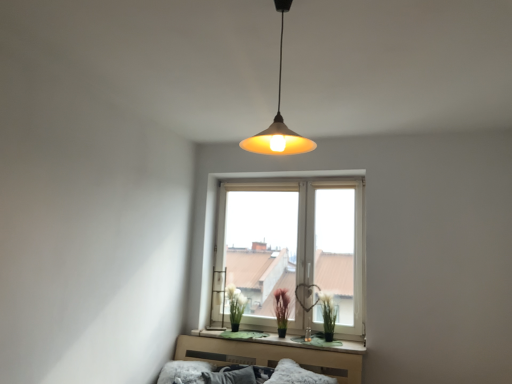
Question: Is fluffy white pillow at lower center, the 1th pillow from the left, to the left of purple matte plant at center, arranged as the first plant when viewed from the left, from the viewer's perspective?

Choices:
 (A) no
 (B) yes

Answer: (B)

Question: Can you confirm if fluffy white pillow at lower center, the second pillow when ordered from right to left, is positioned to the right of purple matte plant at center, arranged as the first plant when viewed from the left?

Choices:
 (A) yes
 (B) no

Answer: (B)

Question: From a real-world perspective, does fluffy white pillow at lower center, the 1th pillow from the left, stand above purple matte plant at center, placed as the second plant when sorted from right to left?

Choices:
 (A) no
 (B) yes

Answer: (A)

Question: Is purple matte plant at center, arranged as the first plant when viewed from the left, at the back of fluffy white pillow at lower center, the 1th pillow from the left?

Choices:
 (A) yes
 (B) no

Answer: (B)

Question: Is fluffy white pillow at lower center, the 1th pillow from the left, in front of purple matte plant at center, placed as the second plant when sorted from right to left?

Choices:
 (A) yes
 (B) no

Answer: (A)

Question: Looking at the image, does green matte plant at window, which is the 2th plant in left-to-right order, seem bigger or smaller compared to white matte plant at center?

Choices:
 (A) big
 (B) small

Answer: (B)

Question: Considering the positions of green matte plant at window, which is the 2th plant in left-to-right order, and white matte plant at center in the image, is green matte plant at window, which is the 2th plant in left-to-right order, wider or thinner than white matte plant at center?

Choices:
 (A) thin
 (B) wide

Answer: (A)

Question: From the image's perspective, is green matte plant at window, which is the 2th plant in left-to-right order, above or below white matte plant at center?

Choices:
 (A) below
 (B) above

Answer: (A)

Question: Considering the positions of green matte plant at window, positioned as the 1th plant in right-to-left order, and white matte plant at center in the image, is green matte plant at window, positioned as the 1th plant in right-to-left order, taller or shorter than white matte plant at center?

Choices:
 (A) short
 (B) tall

Answer: (A)

Question: Looking at their shapes, would you say white matte plant at center is wider or thinner than white plastic window at center?

Choices:
 (A) wide
 (B) thin

Answer: (A)

Question: Considering the positions of white matte plant at center and white plastic window at center in the image, is white matte plant at center bigger or smaller than white plastic window at center?

Choices:
 (A) small
 (B) big

Answer: (A)

Question: From the image's perspective, is white matte plant at center located above or below white plastic window at center?

Choices:
 (A) below
 (B) above

Answer: (A)

Question: From a real-world perspective, is white matte plant at center positioned above or below white plastic window at center?

Choices:
 (A) below
 (B) above

Answer: (A)

Question: Considering the positions of point (174, 375) and point (286, 306), is point (174, 375) closer or farther from the camera than point (286, 306)?

Choices:
 (A) closer
 (B) farther

Answer: (A)

Question: From a real-world perspective, relative to purple matte plant at center, arranged as the first plant when viewed from the left, is fluffy white pillow at lower center, the 1th pillow from the left, vertically above or below?

Choices:
 (A) above
 (B) below

Answer: (B)